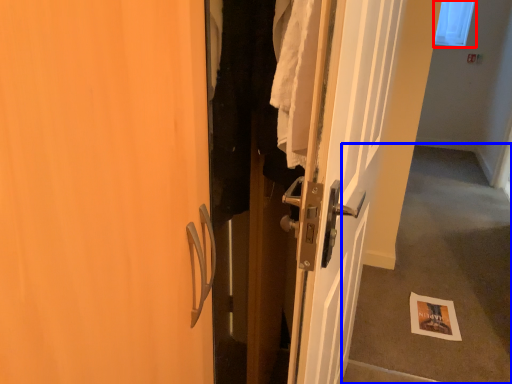
Question: Among these objects, which one is nearest to the camera, window screen (highlighted by a red box) or corridor (highlighted by a blue box)?

Choices:
 (A) window screen
 (B) corridor

Answer: (B)